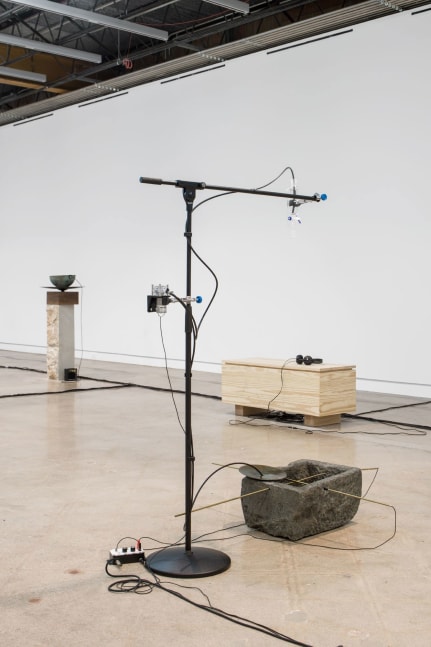
Locate an element on the screen. This screenshot has width=431, height=647. ceiling is located at coordinates (195, 13).